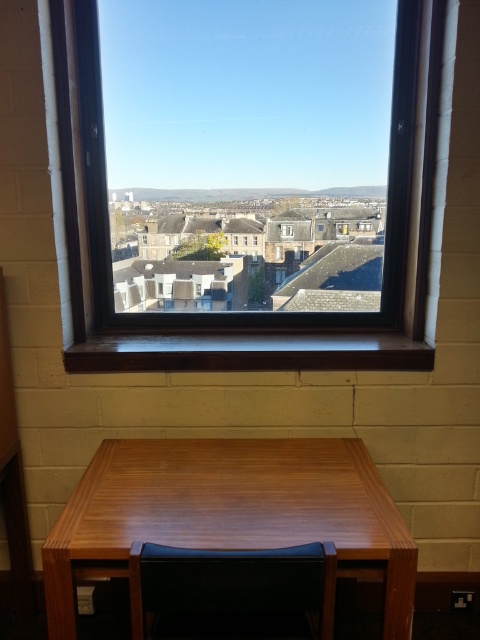
You are standing at the camera position and want to place a 3.5 feet wide painting on the wooden table at center. Is there enough space on the table to fit the painting?

The wooden table at center and camera are 4.40 feet apart. Since the distance between the camera and the table is greater than the painting width, there is sufficient space to place the painting on the wooden table at center.

You are sitting in the room and want to reach the black leather chair at lower center from the wooden table at center. Which direction should you move to get closer to the chair?

Since the wooden table at center is further to the viewer than the black leather chair at lower center, you should move forward towards the window to get closer to the chair.

You are trying to place a large rectangular painting on the wall between the wooden table at center and the clear glass window at center. Which object should you avoid placing the painting too close to, considering their sizes?

You should avoid placing the painting too close to the wooden table at center because it has a larger size compared to the clear glass window at center, so it might block the view or require more space.